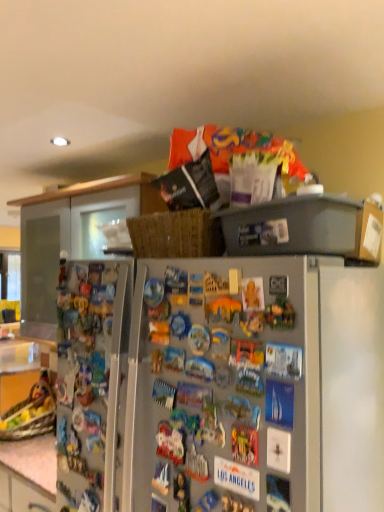
Question: Would you say matte wood cabinet at upper center is inside or outside satin silver refrigerator at center?

Choices:
 (A) inside
 (B) outside

Answer: (B)

Question: From a real-world perspective, relative to satin silver refrigerator at center, is matte wood cabinet at upper center vertically above or below?

Choices:
 (A) above
 (B) below

Answer: (A)

Question: Is matte wood cabinet at upper center taller or shorter than satin silver refrigerator at center?

Choices:
 (A) short
 (B) tall

Answer: (A)

Question: Is satin silver refrigerator at center bigger or smaller than matte wood cabinet at upper center?

Choices:
 (A) big
 (B) small

Answer: (A)

Question: Would you say satin silver refrigerator at center is to the left or to the right of matte wood cabinet at upper center in the picture?

Choices:
 (A) right
 (B) left

Answer: (A)

Question: Looking at their shapes, would you say satin silver refrigerator at center is wider or thinner than matte wood cabinet at upper center?

Choices:
 (A) thin
 (B) wide

Answer: (A)

Question: Is satin silver refrigerator at center spatially inside matte wood cabinet at upper center, or outside of it?

Choices:
 (A) outside
 (B) inside

Answer: (A)